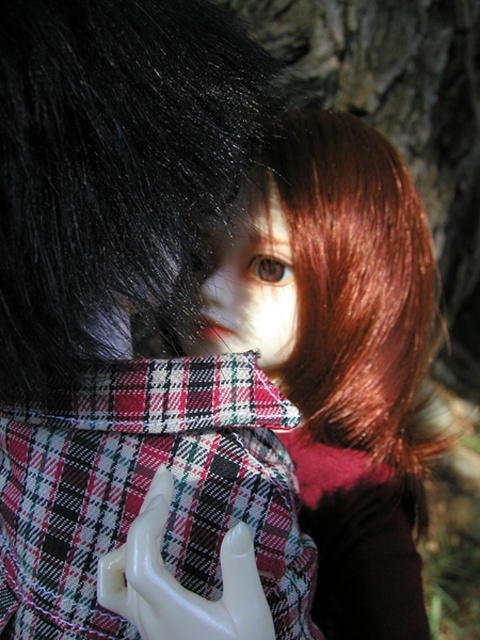
Between plaid fabric at center and white glossy hand at center, which one has less height?

With less height is white glossy hand at center.

Does plaid fabric at center lie behind white glossy hand at center?

Yes, it is behind white glossy hand at center.

The image size is (480, 640). In order to click on plaid fabric at center in this screenshot , I will do `click(145, 492)`.

Is black shiny hair at upper center positioned at the back of white glossy hand at center?

No, black shiny hair at upper center is in front of white glossy hand at center.

Does black shiny hair at upper center appear under white glossy hand at center?

No.

Which is behind, point (44, 125) or point (249, 536)?

Positioned behind is point (249, 536).

Image resolution: width=480 pixels, height=640 pixels. In order to click on black shiny hair at upper center in this screenshot , I will do `click(115, 173)`.

What do you see at coordinates (115, 173) in the screenshot? The height and width of the screenshot is (640, 480). I see `black shiny hair at upper center` at bounding box center [115, 173].

Between black shiny hair at upper center and plaid fabric at center, which one appears on the right side from the viewer's perspective?

black shiny hair at upper center

Between point (192, 44) and point (94, 506), which one is positioned in front?

Point (192, 44) is more forward.

This screenshot has height=640, width=480. What are the coordinates of `black shiny hair at upper center` in the screenshot? It's located at (115, 173).